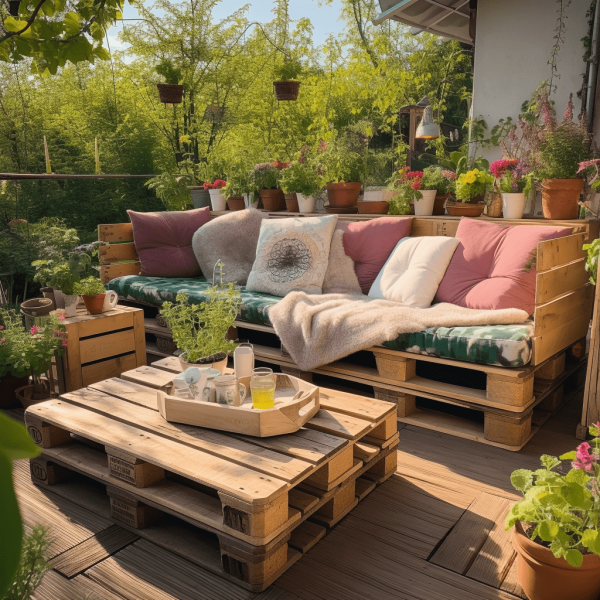
You are a GUI agent. You are given a task and a screenshot of the screen. Output one action in this format:
    pyautogui.click(x=<x>, y=<y>)
    Task: Click on the plush beige throw blanket
    This screenshot has height=600, width=600.
    Given the screenshot: What is the action you would take?
    pyautogui.click(x=333, y=325)